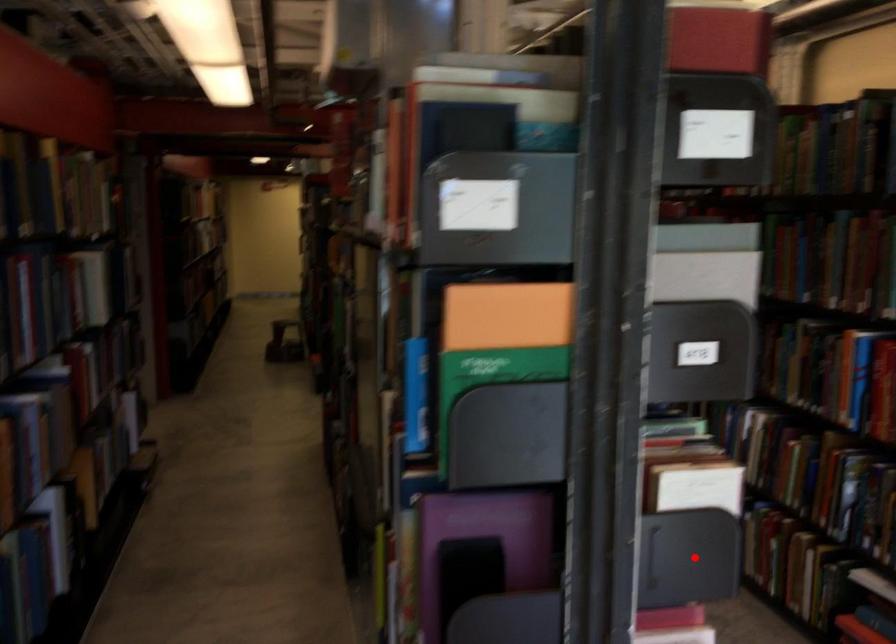
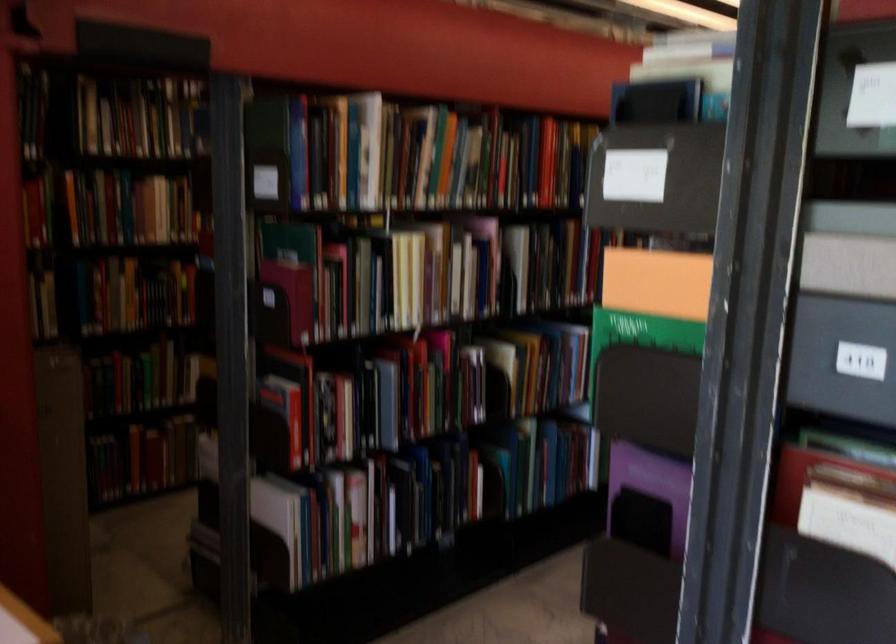
Question: I am providing you with two images of the same scene from different viewpoints. In image1, a red point is highlighted. Considering the same 3D point in image2, which of the following is correct?

Choices:
 (A) It is closer
 (B) It is farther

Answer: (A)